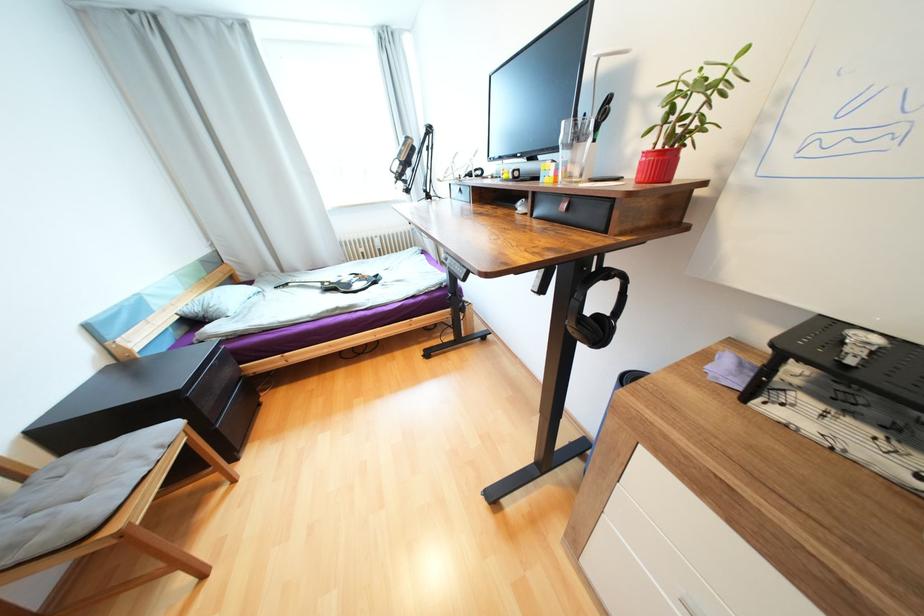
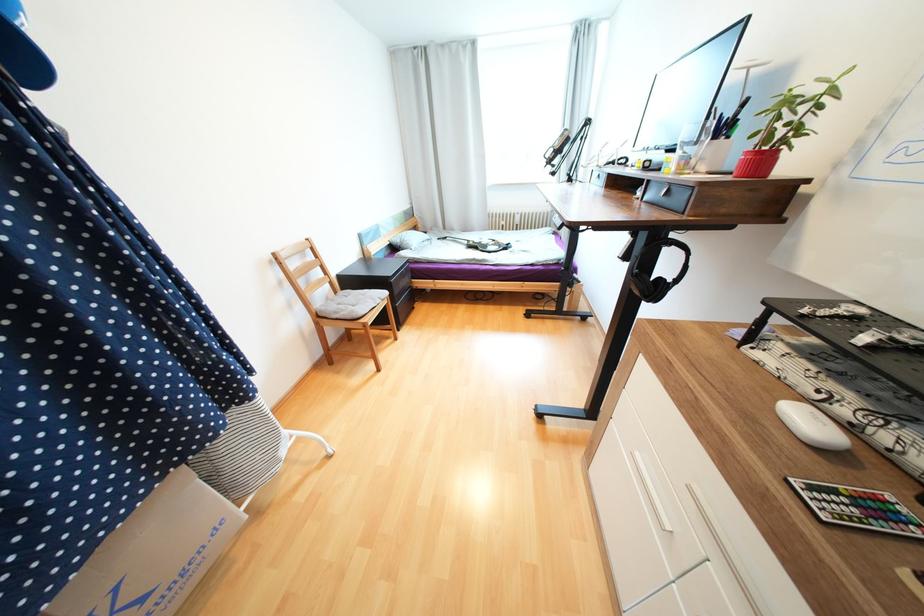
Where in the second image is the point corresponding to the point at 604,315 from the first image?

(665, 280)